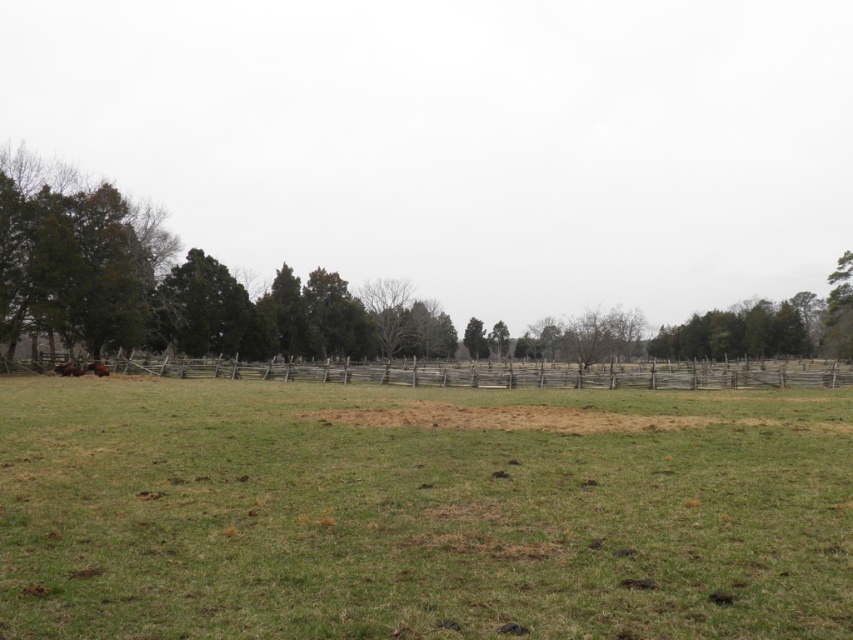
You are standing in the middle of the field and want to walk to the green leafy tree at left. There is a brown fuzzy cow at lower left blocking your path. Can you walk around the cow to reach the tree?

The green leafy tree at left might be wider than brown fuzzy cow at lower left, so you can walk around the cow to reach the tree since the tree is wider and provides more space to navigate around it.

You are standing in the middle of the field and want to take a photo of both the green leafy tree at left and the brown fuzzy cow at lower left. Which object should you position closer to the edge of the frame to ensure both are fully visible?

You should position the brown fuzzy cow at lower left closer to the edge of the frame because the green leafy tree at left is taller and might block the view of the cow if placed centrally.

You are planning to plant a new tree in the field shown in the image. The new tree will grow to be the same size as the green leafy tree at left. Considering the space occupied by the weathered wood fence at center, will the new tree fit without overlapping the fence?

The green leafy tree at left has a larger size compared to the weathered wood fence at center. Since the new tree will grow to be the same size as the green leafy tree at left, it will occupy more space than the weathered wood fence at center. Therefore, the new tree will not overlap the fence as long as it is planted with sufficient distance from the fence to accommodate its size.